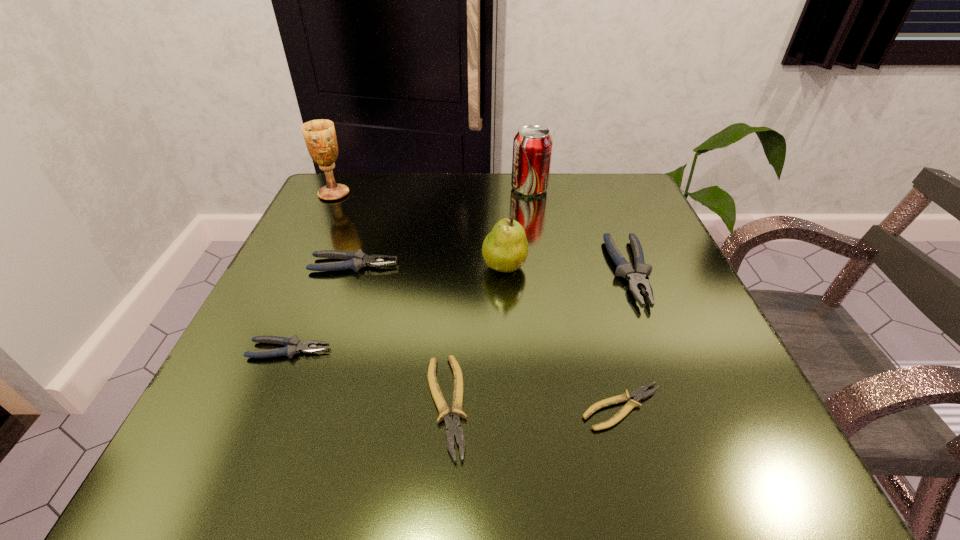
Locate an element on the screen. the third pliers from left to right is located at coordinates (453, 427).

This screenshot has width=960, height=540. I want to click on the shortest object, so click(638, 395).

Where is `the smaller yellow pliers`? the smaller yellow pliers is located at coordinates (638, 395).

Where is `free location located 0.310m on the right of the chalice`? free location located 0.310m on the right of the chalice is located at coordinates (479, 194).

At what (x,y) coordinates should I click in order to perform the action: click on vacant space located on the front of the seventh shortest object. Please return your answer as a coordinate pair (x, y). The width and height of the screenshot is (960, 540). Looking at the image, I should click on (540, 253).

Identify the location of vacant area situated 0.320m on the front of the third tallest object. This screenshot has height=540, width=960. (516, 444).

The width and height of the screenshot is (960, 540). Identify the location of free region located 0.200m at the gripping part of the fifth shortest object. (687, 415).

You are a GUI agent. You are given a task and a screenshot of the screen. Output one action in this format:
    pyautogui.click(x=<x>, y=<y>)
    Task: Click on the vacant area situated 0.200m at the gripping part of the second smallest gray pliers
    Image resolution: width=960 pixels, height=540 pixels.
    Given the screenshot: What is the action you would take?
    pyautogui.click(x=501, y=265)

The width and height of the screenshot is (960, 540). Find the location of `free space located at the gripping part of the third shortest pliers`. free space located at the gripping part of the third shortest pliers is located at coordinates (584, 350).

Where is `vacant space located 0.340m on the right of the third pliers from right to left`? vacant space located 0.340m on the right of the third pliers from right to left is located at coordinates (710, 406).